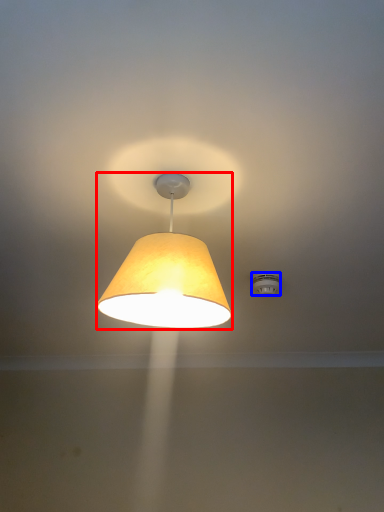
Question: Which of the following is the farthest to the observer, lamp (highlighted by a red box) or lighting (highlighted by a blue box)?

Choices:
 (A) lamp
 (B) lighting

Answer: (B)